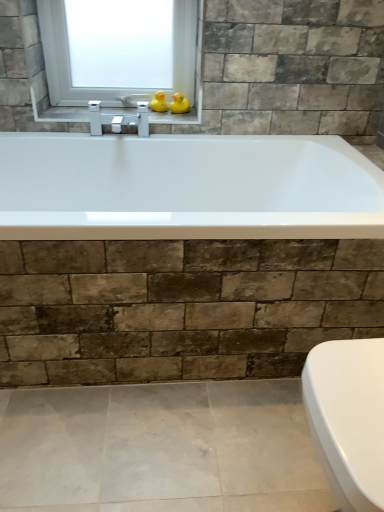
Question: Does point (183, 106) appear closer or farther from the camera than point (162, 120)?

Choices:
 (A) farther
 (B) closer

Answer: (A)

Question: Considering the positions of yellow rubber duck at upper center, which is counted as the second duck, starting from the left, and metallic silver faucet at upper center in the image, is yellow rubber duck at upper center, which is counted as the second duck, starting from the left, bigger or smaller than metallic silver faucet at upper center?

Choices:
 (A) small
 (B) big

Answer: (A)

Question: Which object is positioned farthest from the yellow rubber duck at upper center, positioned as the 1th duck in right-to-left order?

Choices:
 (A) metallic silver faucet at upper center
 (B) transparent glass window at upper center
 (C) rubber duck at upper center, the first duck in the left-to-right sequence

Answer: (B)

Question: Based on their relative distances, which object is farther from the yellow rubber duck at upper center, which is counted as the second duck, starting from the left?

Choices:
 (A) metallic silver faucet at upper center
 (B) rubber duck at upper center, which is the second duck in right-to-left order
 (C) transparent glass window at upper center

Answer: (C)